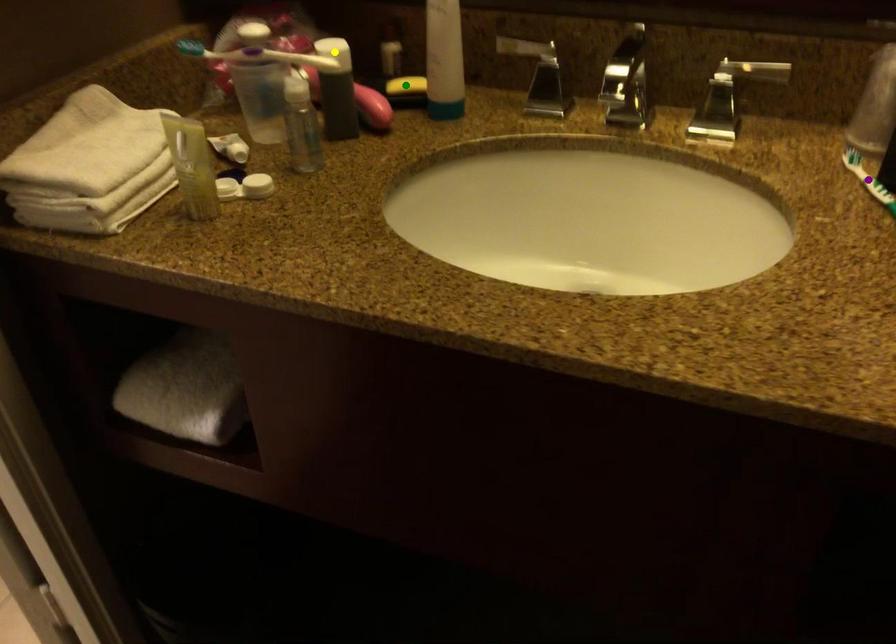
Order these from nearest to farthest:
yellow point | purple point | green point

purple point < yellow point < green point